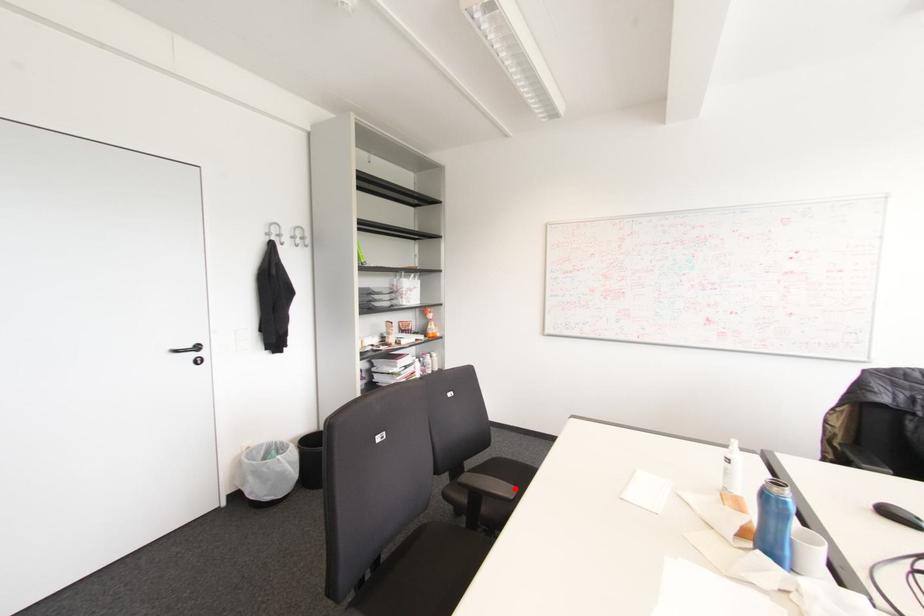
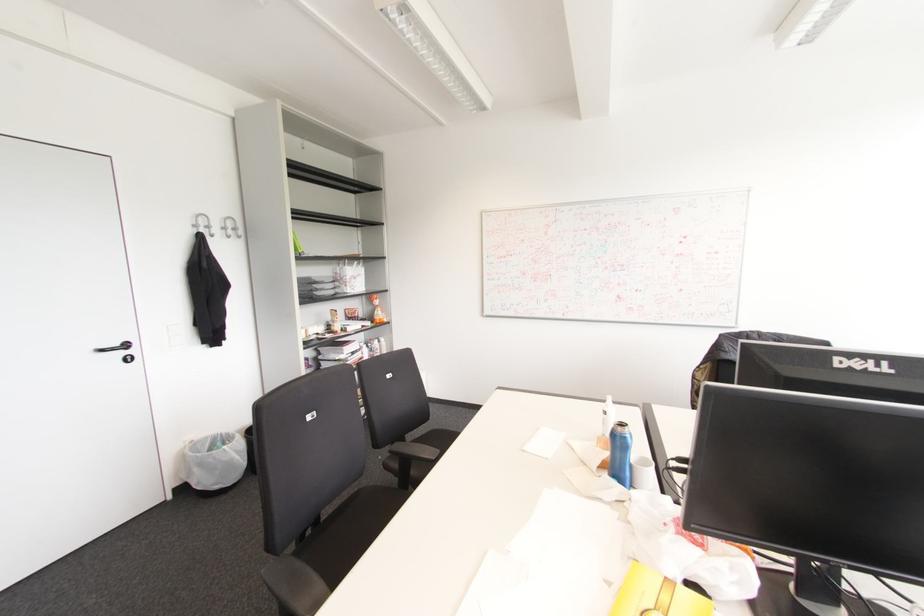
Question: I am providing you with two images of the same scene from different viewpoints. Given a red point in image1, look at the same physical point in image2. Is it:

Choices:
 (A) Closer to the viewpoint
 (B) Farther from the viewpoint

Answer: (A)